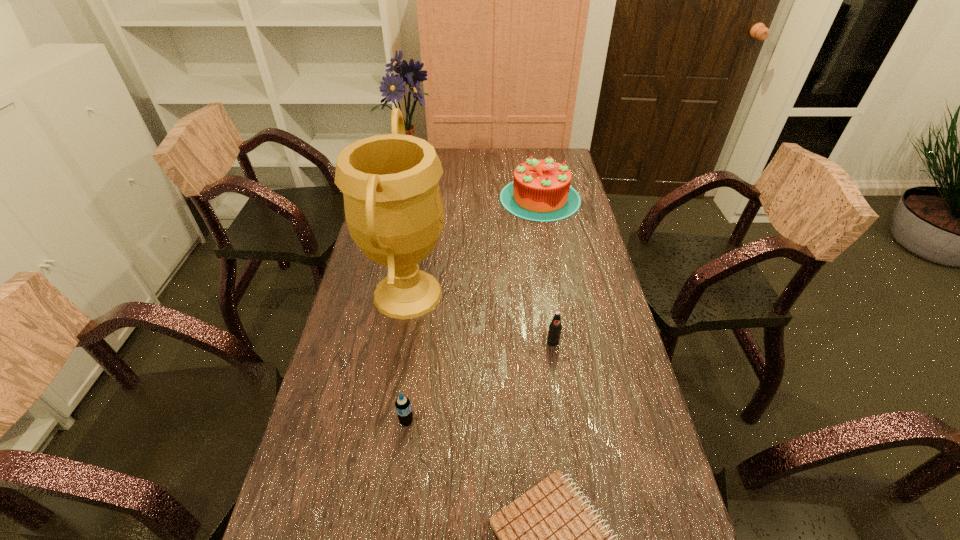
Find the location of a particular element. The width and height of the screenshot is (960, 540). free space located 0.350m on the back of the left soda bottle is located at coordinates (421, 307).

In order to click on flower arrangement that is at the left edge in this screenshot , I will do `click(393, 88)`.

The height and width of the screenshot is (540, 960). In order to click on trophy situated at the left edge in this screenshot , I will do `click(394, 211)`.

I want to click on object present at the right edge, so click(541, 191).

In the image, there is a desktop. Where is `blank space at the left edge`? blank space at the left edge is located at coordinates (361, 435).

This screenshot has width=960, height=540. In the image, there is a desktop. In order to click on vacant space at the right edge in this screenshot , I will do `click(578, 313)`.

Identify the location of free spot between the cake and the trophy. The height and width of the screenshot is (540, 960). (474, 246).

You are a GUI agent. You are given a task and a screenshot of the screen. Output one action in this format:
    pyautogui.click(x=<x>, y=<y>)
    Task: Click on the empty location between the cake and the trophy
    This screenshot has width=960, height=540.
    Given the screenshot: What is the action you would take?
    pyautogui.click(x=474, y=246)

You are a GUI agent. You are given a task and a screenshot of the screen. Output one action in this format:
    pyautogui.click(x=<x>, y=<y>)
    Task: Click on the free space between the trophy and the left soda bottle
    The image size is (960, 540).
    Given the screenshot: What is the action you would take?
    pyautogui.click(x=407, y=357)

I want to click on vacant space in between the right soda bottle and the trophy, so click(x=480, y=318).